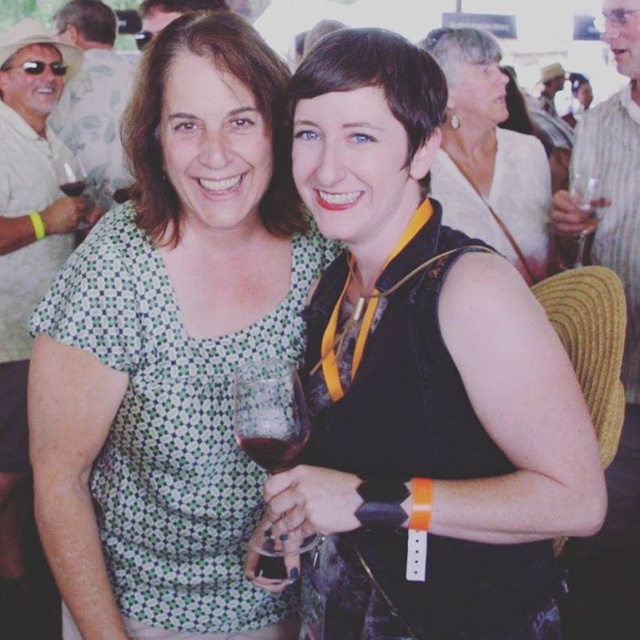
Does matte black vest at center have a greater height compared to black matte vest at center?

Yes.

Can you confirm if matte black vest at center is shorter than black matte vest at center?

In fact, matte black vest at center may be taller than black matte vest at center.

The image size is (640, 640). What do you see at coordinates (420, 380) in the screenshot? I see `matte black vest at center` at bounding box center [420, 380].

This screenshot has height=640, width=640. I want to click on matte black vest at center, so click(420, 380).

Is point (516, 209) positioned behind point (276, 410)?

That is True.

Can you confirm if black matte vest at center is positioned below transparent glass at center?

No, black matte vest at center is not below transparent glass at center.

Where is `black matte vest at center`? Image resolution: width=640 pixels, height=640 pixels. black matte vest at center is located at coordinates (488, 156).

I want to click on black matte vest at center, so click(x=488, y=156).

The width and height of the screenshot is (640, 640). What do you see at coordinates (420, 380) in the screenshot?
I see `matte black vest at center` at bounding box center [420, 380].

Does point (518, 282) come behind point (298, 552)?

No, (518, 282) is closer to viewer.

I want to click on matte black vest at center, so pos(420,380).